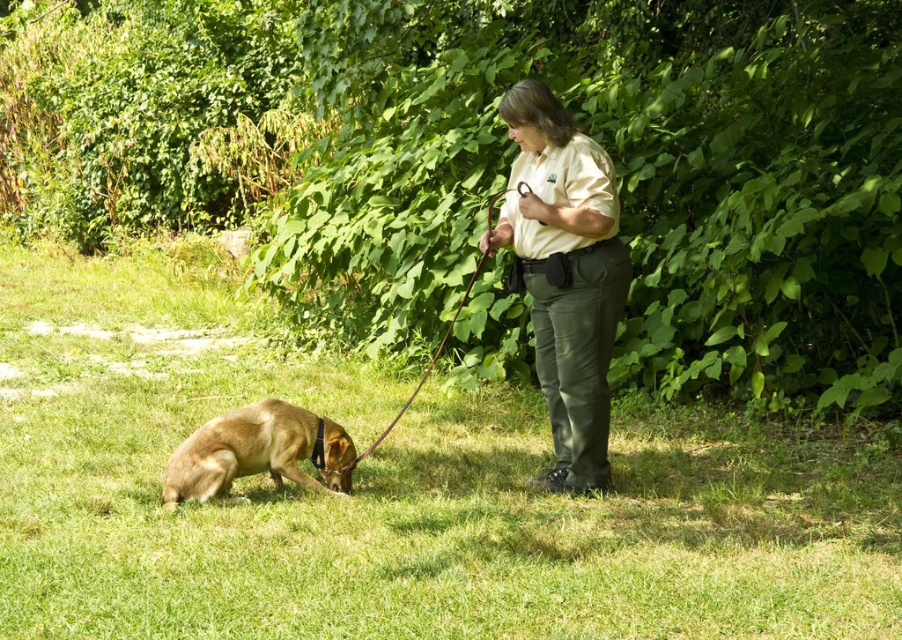
You are standing at the camera position and want to know how far the point at coordinates point (194,493) is from you. Can you determine the distance?

The point at coordinates point (194,493) is 5.72 meters away from the camera position.

You are standing in the outdoor scene described. You see the green grass at lower center and the black leather leash at center. Which object is located lower in the image?

The green grass at lower center is located below the black leather leash at center, so the green grass at lower center is lower in the image.

You are a photographer setting up a shot of the scene. You want to ensure both the green grass at lower center and the black leather leash at center are clearly visible. Which object should you focus on first if you need to prioritize the larger one?

The green grass at lower center is larger in size than the black leather leash at center, so you should focus on the green grass at lower center first to ensure it is clearly visible.